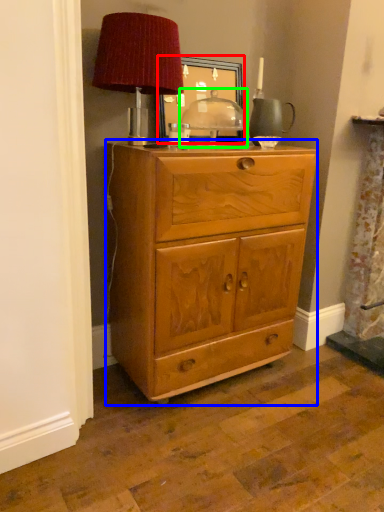
Question: Which is farther away from picture frame (highlighted by a red box)? chest of drawers (highlighted by a blue box) or table (highlighted by a green box)?

Choices:
 (A) chest of drawers
 (B) table

Answer: (A)